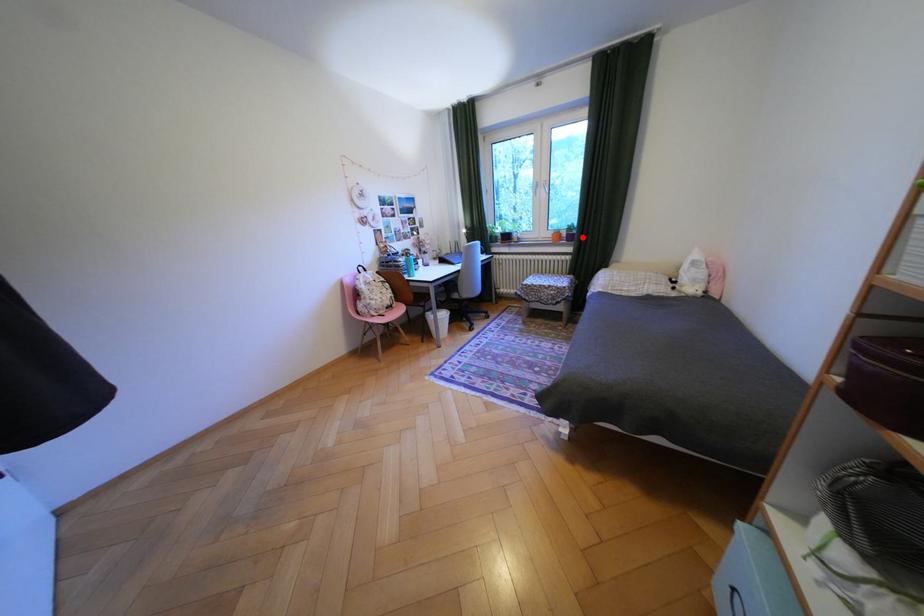
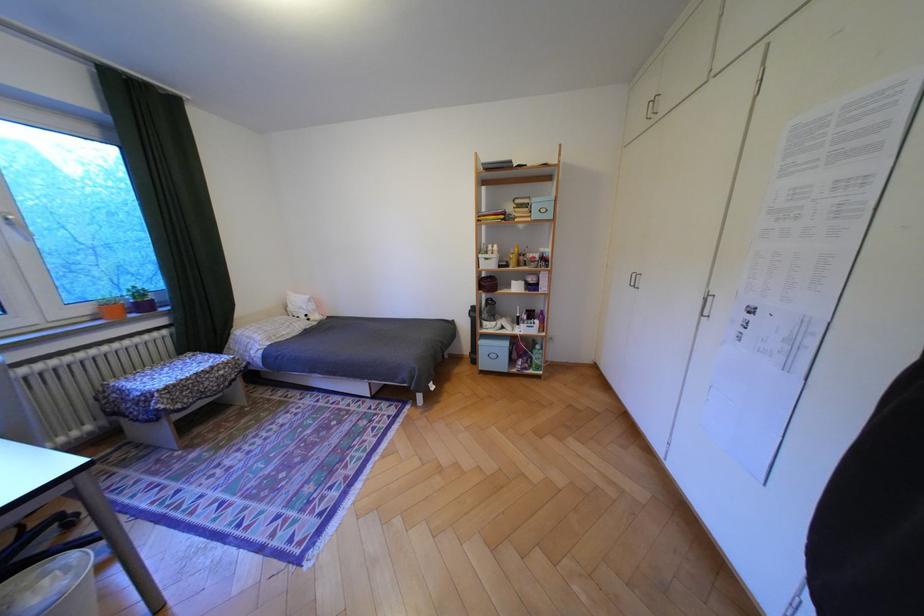
In the second image, find the point that corresponds to the highlighted location in the first image.

(155, 307)